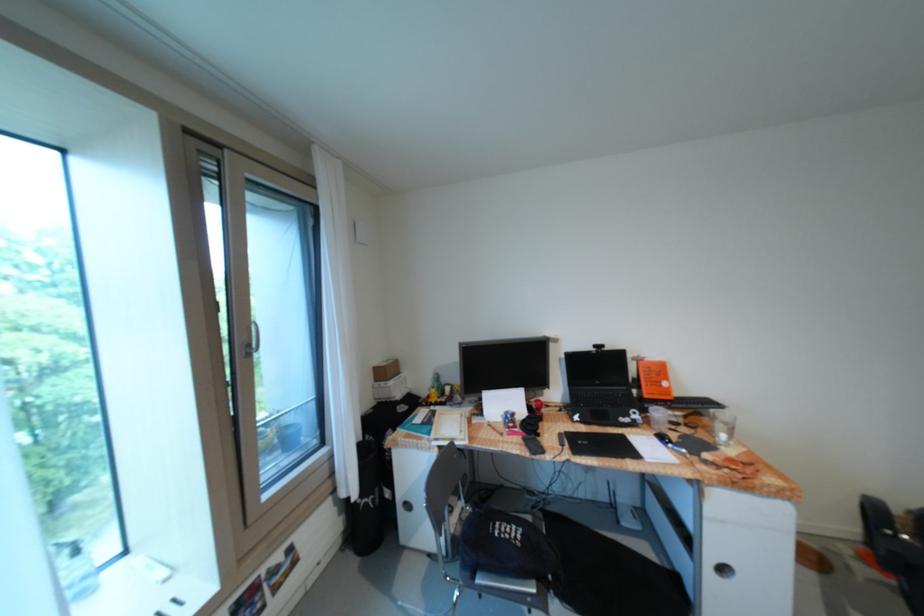
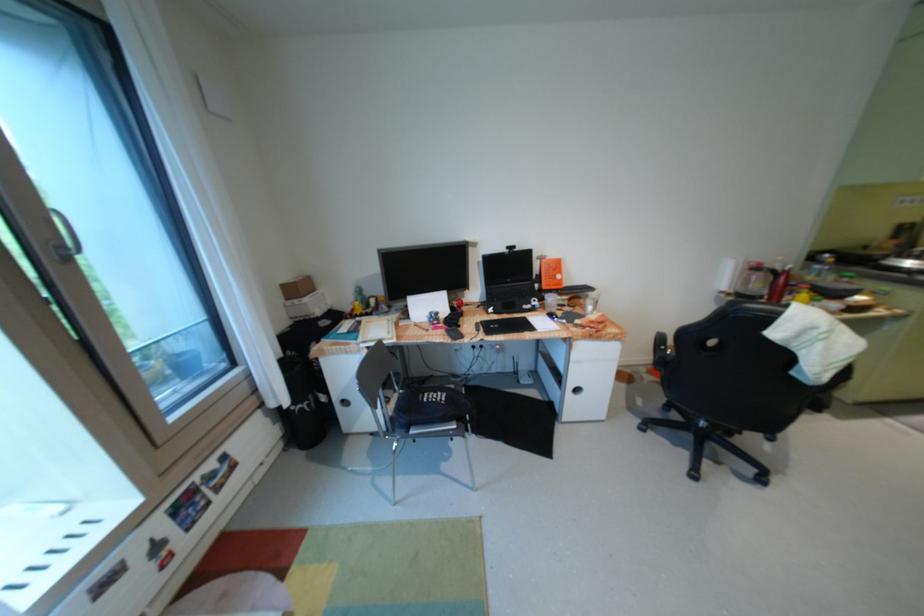
In the second image, find the point that corresponds to the point at 720,556 in the first image.

(580, 386)